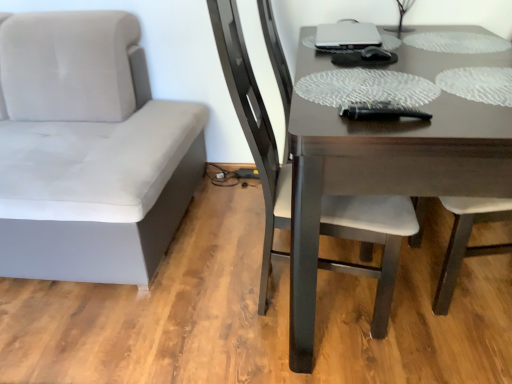
Question: Can you see suede gray chair at left, positioned as the 1th chair in left-to-right order, touching dark brown wooden table at center?

Choices:
 (A) yes
 (B) no

Answer: (B)

Question: Is the depth of suede gray chair at left, positioned as the 1th chair in left-to-right order, less than that of dark brown wooden table at center?

Choices:
 (A) no
 (B) yes

Answer: (A)

Question: Can we say suede gray chair at left, positioned as the 1th chair in left-to-right order, lies outside dark brown wooden table at center?

Choices:
 (A) no
 (B) yes

Answer: (B)

Question: Is suede gray chair at left, placed as the 2th chair when sorted from right to left, further to the viewer compared to dark brown wooden table at center?

Choices:
 (A) yes
 (B) no

Answer: (A)

Question: From the image's perspective, is suede gray chair at left, placed as the 2th chair when sorted from right to left, beneath dark brown wooden table at center?

Choices:
 (A) no
 (B) yes

Answer: (A)

Question: Is dark brown wooden table at center taller or shorter than dark brown wood chair at center, acting as the 1th chair starting from the right?

Choices:
 (A) short
 (B) tall

Answer: (A)

Question: Does point (473, 165) appear closer or farther from the camera than point (264, 157)?

Choices:
 (A) closer
 (B) farther

Answer: (A)

Question: Is dark brown wooden table at center inside the boundaries of dark brown wood chair at center, acting as the 1th chair starting from the right, or outside?

Choices:
 (A) inside
 (B) outside

Answer: (B)

Question: From the image's perspective, is dark brown wooden table at center above or below dark brown wood chair at center, arranged as the second chair when viewed from the left?

Choices:
 (A) below
 (B) above

Answer: (B)

Question: From the image's perspective, is dark brown wooden table at center located above or below satin silver laptop at upper center?

Choices:
 (A) below
 (B) above

Answer: (A)

Question: In the image, is dark brown wooden table at center on the left side or the right side of satin silver laptop at upper center?

Choices:
 (A) right
 (B) left

Answer: (A)

Question: From a real-world perspective, relative to satin silver laptop at upper center, is dark brown wooden table at center vertically above or below?

Choices:
 (A) above
 (B) below

Answer: (B)

Question: From their relative heights in the image, would you say dark brown wooden table at center is taller or shorter than satin silver laptop at upper center?

Choices:
 (A) tall
 (B) short

Answer: (A)

Question: In terms of width, does satin silver laptop at upper center look wider or thinner when compared to dark brown wooden table at center?

Choices:
 (A) thin
 (B) wide

Answer: (A)

Question: Looking at the image, does satin silver laptop at upper center seem bigger or smaller compared to dark brown wooden table at center?

Choices:
 (A) big
 (B) small

Answer: (B)